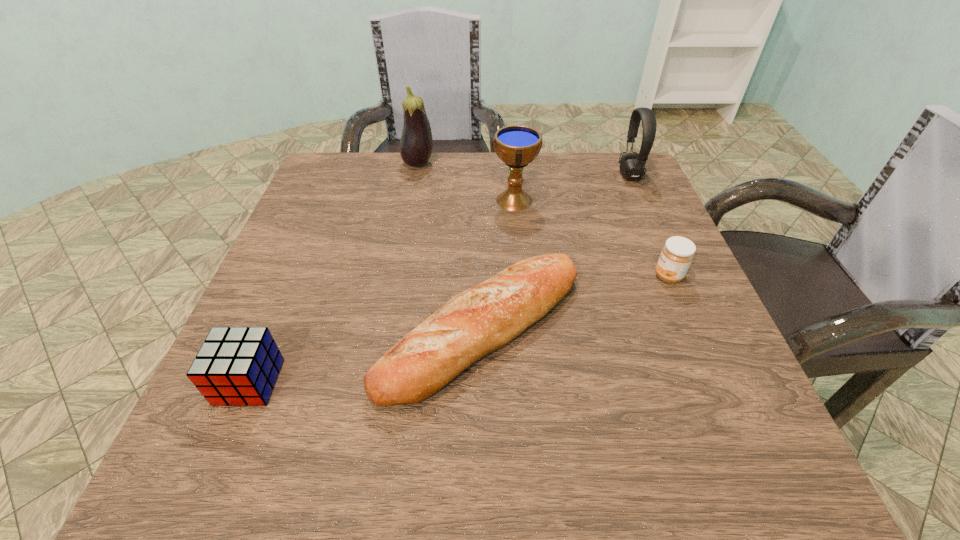
You are a GUI agent. You are given a task and a screenshot of the screen. Output one action in this format:
    pyautogui.click(x=<x>, y=<y>)
    Task: Click on the headset that is at the right edge
    
    Given the screenshot: What is the action you would take?
    pyautogui.click(x=632, y=165)

The image size is (960, 540). In order to click on jam present at the right edge in this screenshot , I will do `click(676, 256)`.

This screenshot has width=960, height=540. What are the coordinates of `object that is at the far right corner` in the screenshot? It's located at (632, 165).

The height and width of the screenshot is (540, 960). In order to click on free space at the far edge in this screenshot , I will do `click(469, 166)`.

In the image, there is a desktop. Identify the location of vacant space at the left edge. (340, 244).

In the image, there is a desktop. Identify the location of vacant space at the right edge. (725, 402).

Where is `vacant space at the far left corner of the desktop`? This screenshot has height=540, width=960. vacant space at the far left corner of the desktop is located at coordinates (365, 154).

In the image, there is a desktop. Identify the location of free space at the near left corner. (201, 476).

This screenshot has width=960, height=540. I want to click on blank space at the far right corner of the desktop, so click(588, 166).

You are a GUI agent. You are given a task and a screenshot of the screen. Output one action in this format:
    pyautogui.click(x=<x>, y=<y>)
    Task: Click on the vacant area that lies between the chalice and the cube
    
    Given the screenshot: What is the action you would take?
    pyautogui.click(x=382, y=291)